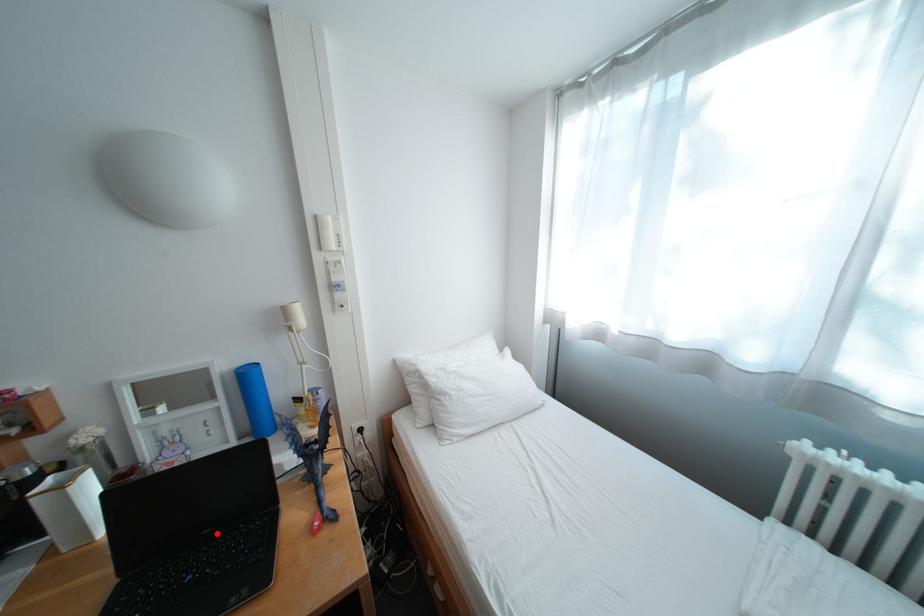
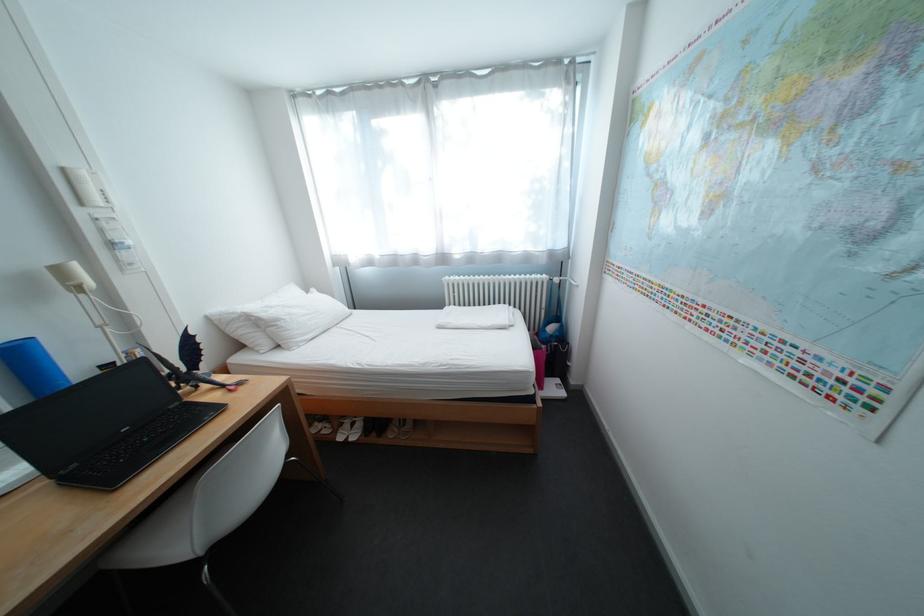
Find the pixel in the second image that matches the highlighted location in the first image.

(137, 431)